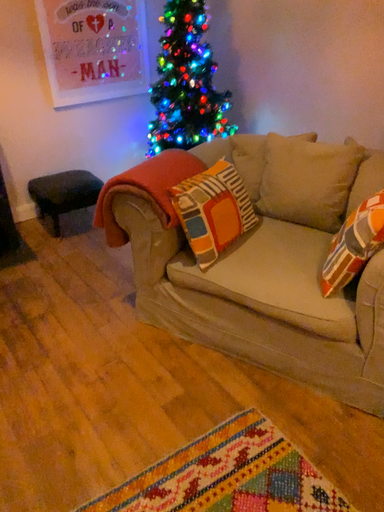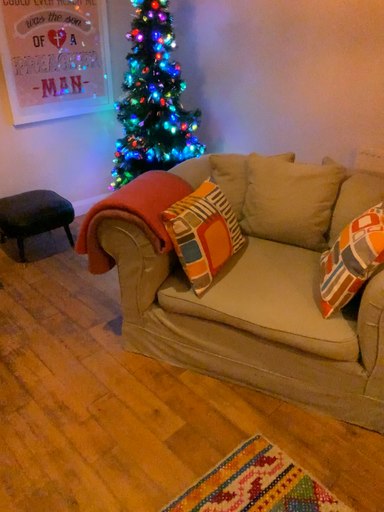
Question: How did the camera likely rotate when shooting the video?

Choices:
 (A) rotated left
 (B) rotated right

Answer: (B)